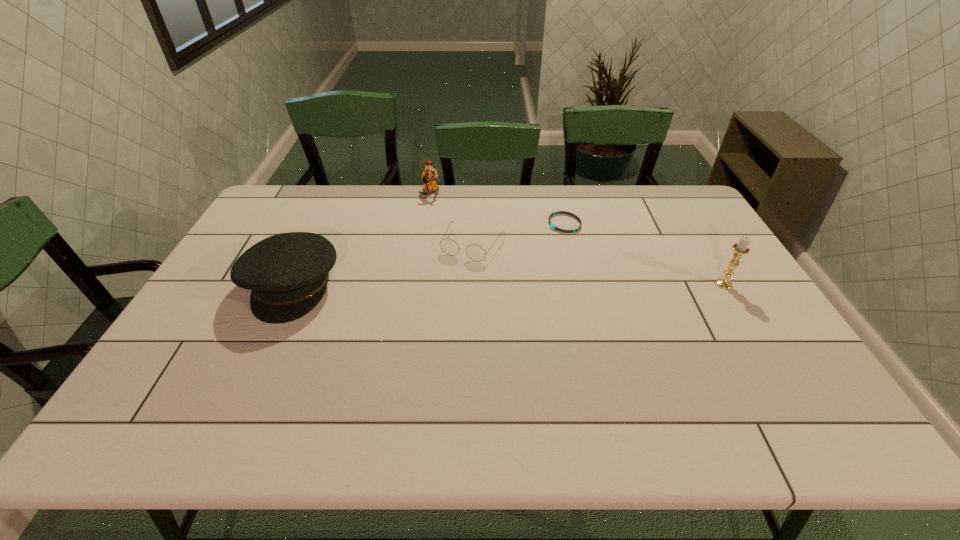
Locate which object is the closest to the fourth object from left to right. Please provide its 2D coordinates. Your answer should be formatted as a tuple, i.e. [(x, y)], where the tuple contains the x and y coordinates of a point satisfying the conditions above.

[(475, 252)]

You are a GUI agent. You are given a task and a screenshot of the screen. Output one action in this format:
    pyautogui.click(x=<x>, y=<y>)
    Task: Click on the closest object to the beret
    
    Given the screenshot: What is the action you would take?
    pyautogui.click(x=475, y=252)

Locate an element on the screen. free space that satisfies the following two spatial constraints: 1. on the front side of the second object from right to left; 2. on the left side of the second object from left to right is located at coordinates (426, 224).